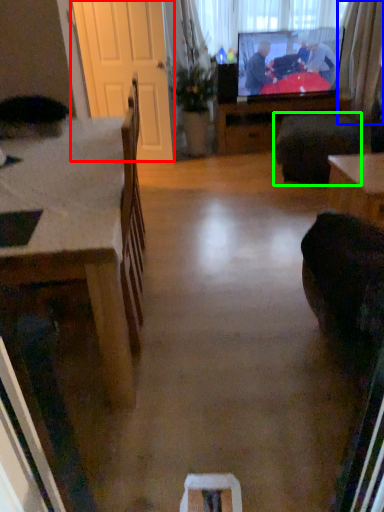
Question: Based on their relative distances, which object is farther from screen door (highlighted by a red box)? Choose from curtain (highlighted by a blue box) and footrest (highlighted by a green box).

Choices:
 (A) curtain
 (B) footrest

Answer: (A)